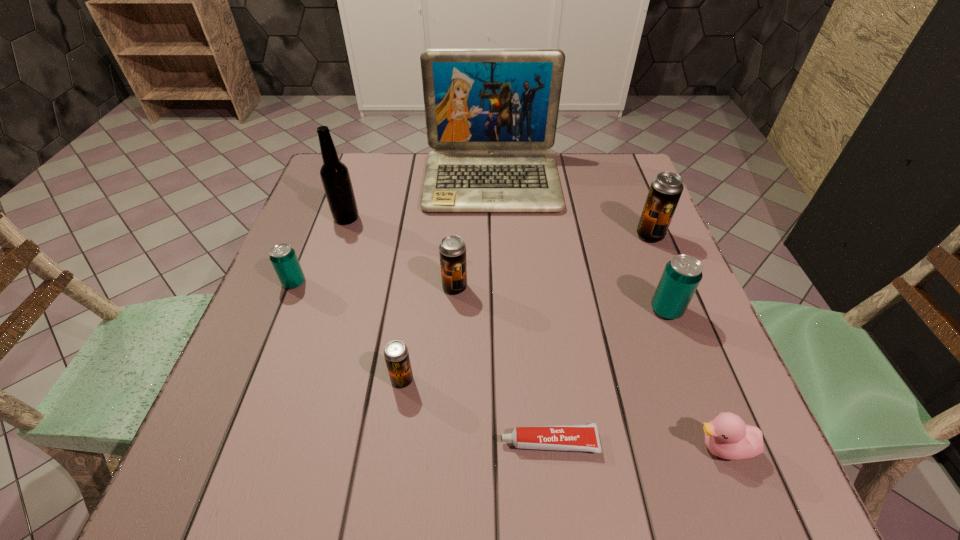
Where is `laptop computer`? laptop computer is located at coordinates (491, 115).

Locate an element on the screen. The width and height of the screenshot is (960, 540). the second object from left to right is located at coordinates (335, 176).

The height and width of the screenshot is (540, 960). Find the location of `beer bottle`. beer bottle is located at coordinates (x=335, y=176).

Find the location of `the third tallest object`. the third tallest object is located at coordinates (665, 191).

Where is `the third farthest object`? This screenshot has width=960, height=540. the third farthest object is located at coordinates (665, 191).

Locate an element on the screen. The height and width of the screenshot is (540, 960). the third beer can from left to right is located at coordinates (452, 250).

This screenshot has height=540, width=960. I want to click on the second black beer can from left to right, so click(452, 250).

Identify the location of the nearer teal beer can. (682, 275).

At what (x,y) coordinates should I click in order to perform the action: click on the right teal beer can. Please return your answer as a coordinate pair (x, y). Looking at the image, I should click on (682, 275).

Identify the location of the leftmost object. (282, 256).